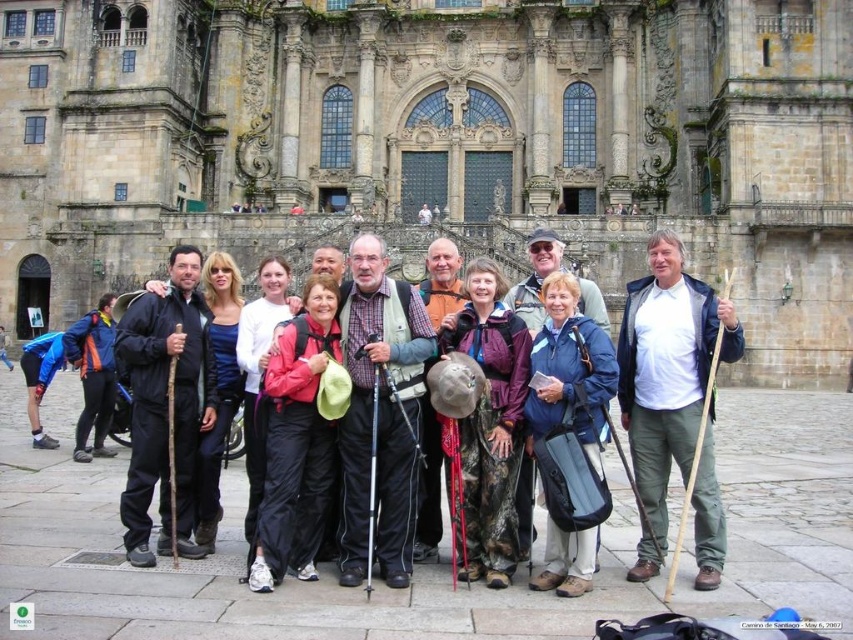
Question: Which object appears closest to the camera in this image?

Choices:
 (A) stone textured palace at center
 (B) matte pink jacket at center
 (C) white matte shirt at center

Answer: (B)

Question: Considering the relative positions of blue fabric backpack at center and matte pink jacket at center in the image provided, where is blue fabric backpack at center located with respect to matte pink jacket at center?

Choices:
 (A) left
 (B) right

Answer: (B)

Question: Which of these objects is positioned closest to the stone textured palace at center?

Choices:
 (A) camouflage fabric hat at center
 (B) orange waterproof jacket at left

Answer: (B)

Question: Can you confirm if plaid fabric shirt at center is wider than camouflage fabric hat at center?

Choices:
 (A) no
 (B) yes

Answer: (B)

Question: Which object appears farthest from the camera in this image?

Choices:
 (A) white matte shirt at center
 (B) orange waterproof jacket at left
 (C) plaid fabric shirt at center
 (D) camouflage fabric hat at center

Answer: (B)

Question: Does stone textured palace at center appear on the right side of orange waterproof jacket at left?

Choices:
 (A) no
 (B) yes

Answer: (B)